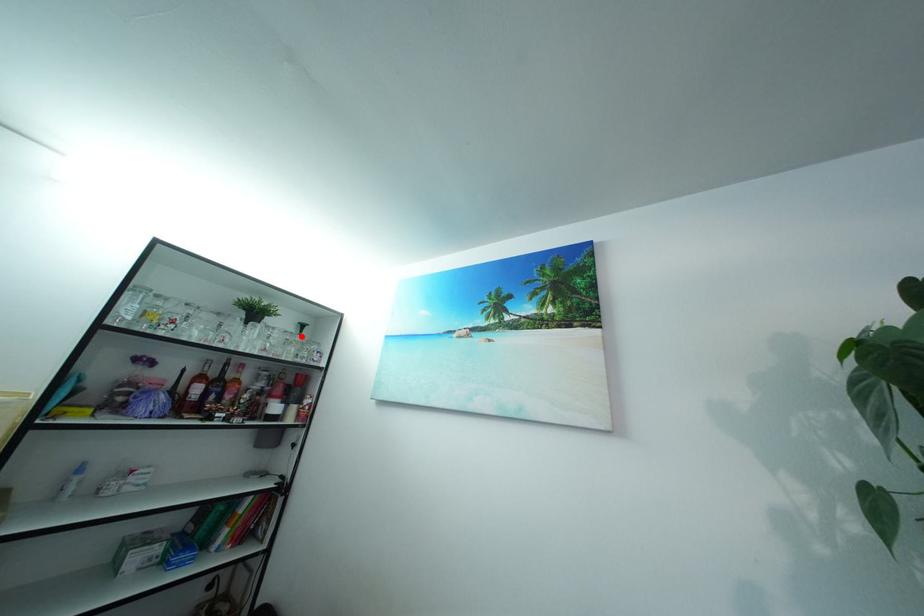
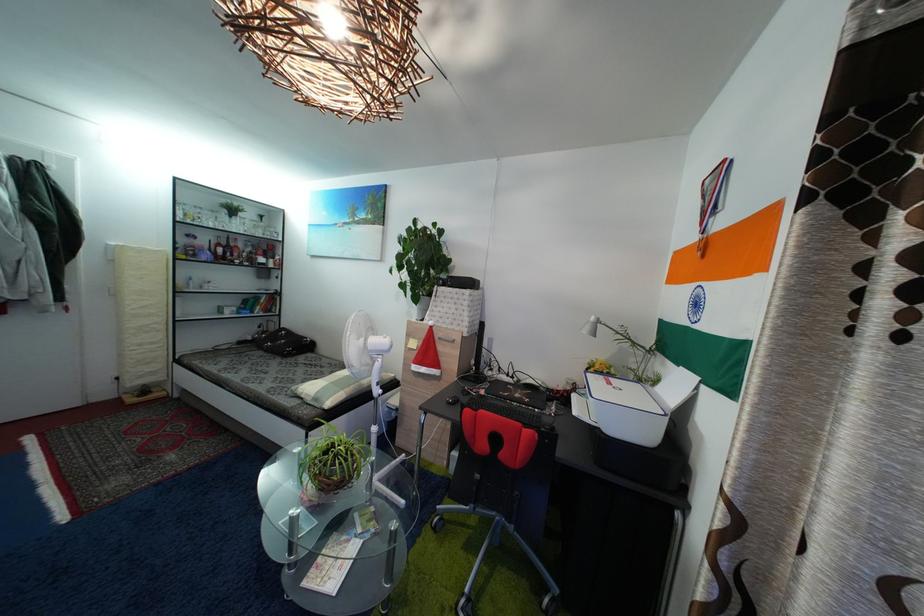
Question: I am providing you with two images of the same scene from different viewpoints. Given a red point in image1, look at the same physical point in image2. Is it:

Choices:
 (A) Closer to the viewpoint
 (B) Farther from the viewpoint

Answer: (A)